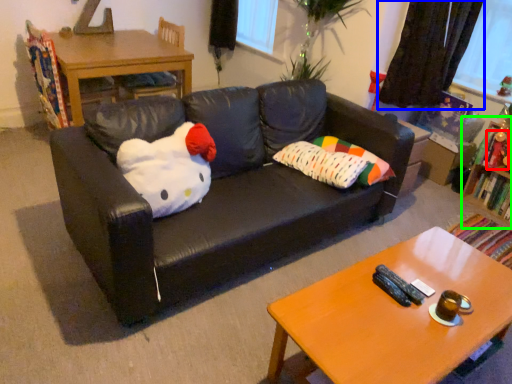
Question: Considering the real-world distances, which object is farthest from toy (highlighted by a red box)? curtain (highlighted by a blue box) or bookshelf (highlighted by a green box)?

Choices:
 (A) curtain
 (B) bookshelf

Answer: (A)